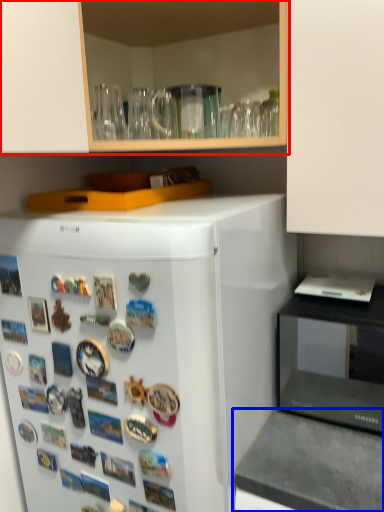
Question: Among these objects, which one is nearest to the camera, cabinetry (highlighted by a red box) or counter top (highlighted by a blue box)?

Choices:
 (A) cabinetry
 (B) counter top

Answer: (B)